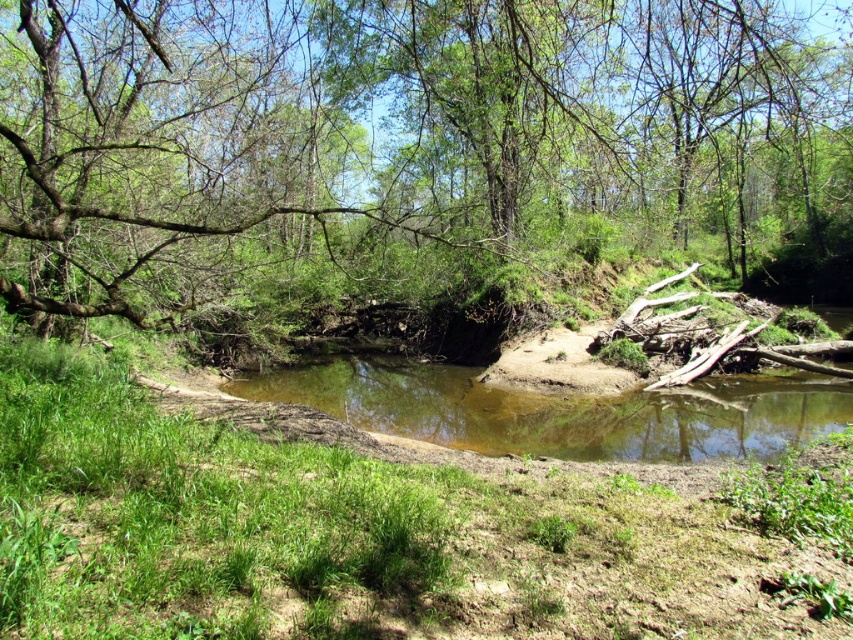
Does green leafy tree at center appear under brown sandy river at center?

No.

Can you confirm if green leafy tree at center is bigger than brown sandy river at center?

Correct, green leafy tree at center is larger in size than brown sandy river at center.

The height and width of the screenshot is (640, 853). What do you see at coordinates (399, 141) in the screenshot?
I see `green leafy tree at center` at bounding box center [399, 141].

Find the location of a particular element. The height and width of the screenshot is (640, 853). green leafy tree at center is located at coordinates (399, 141).